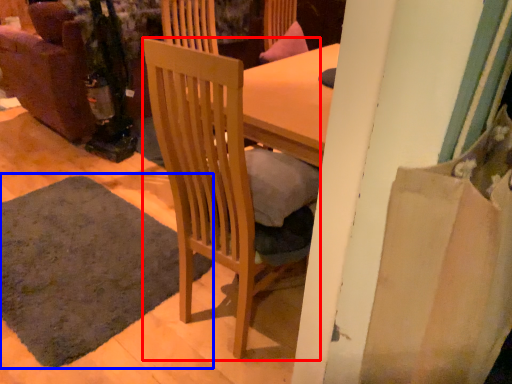
Question: Which object appears farthest to the camera in this image, chair (highlighted by a red box) or mat (highlighted by a blue box)?

Choices:
 (A) chair
 (B) mat

Answer: (B)